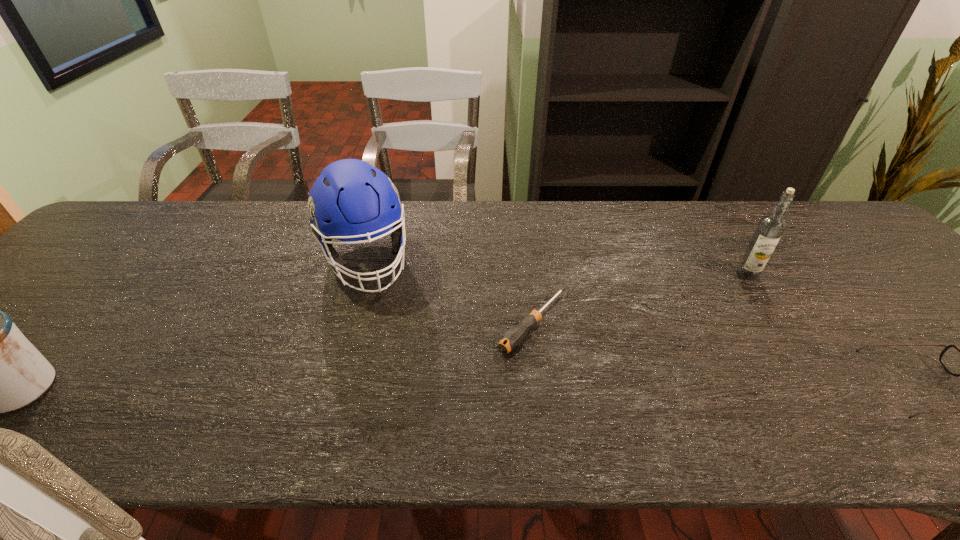
Where is `free space on the desktop that is between the leftmost object and the rightmost object and is positioned on the front-facing side of the football helmet`? The height and width of the screenshot is (540, 960). free space on the desktop that is between the leftmost object and the rightmost object and is positioned on the front-facing side of the football helmet is located at coordinates (414, 388).

This screenshot has height=540, width=960. What are the coordinates of `vacant space on the desktop that is between the third tallest object and the rightmost object and is positioned on the label of the fourth object from left to right` in the screenshot? It's located at (589, 388).

Where is `free space on the desktop that is between the third tallest object and the sunglasses and is positioned at the tip of the third object from left to right`? free space on the desktop that is between the third tallest object and the sunglasses and is positioned at the tip of the third object from left to right is located at coordinates (468, 388).